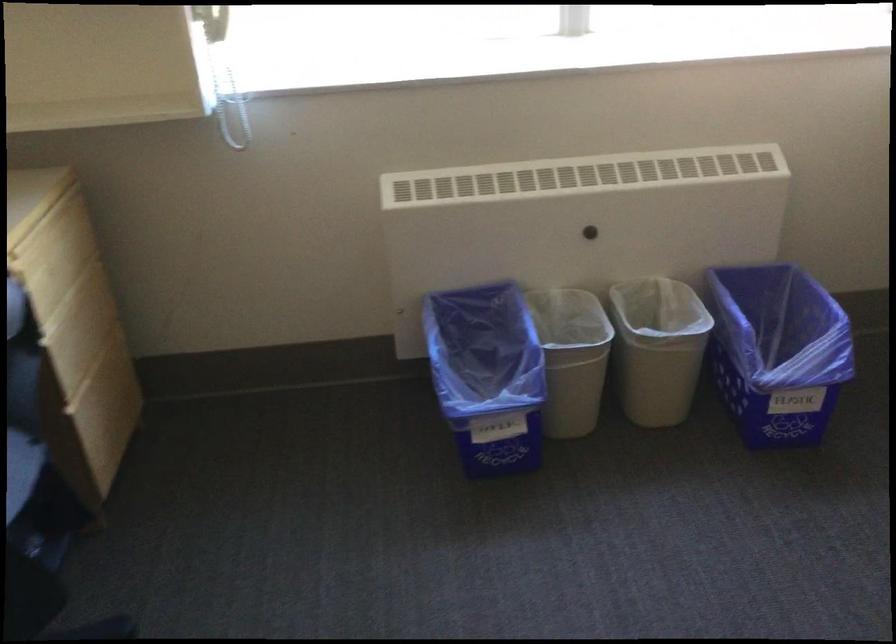
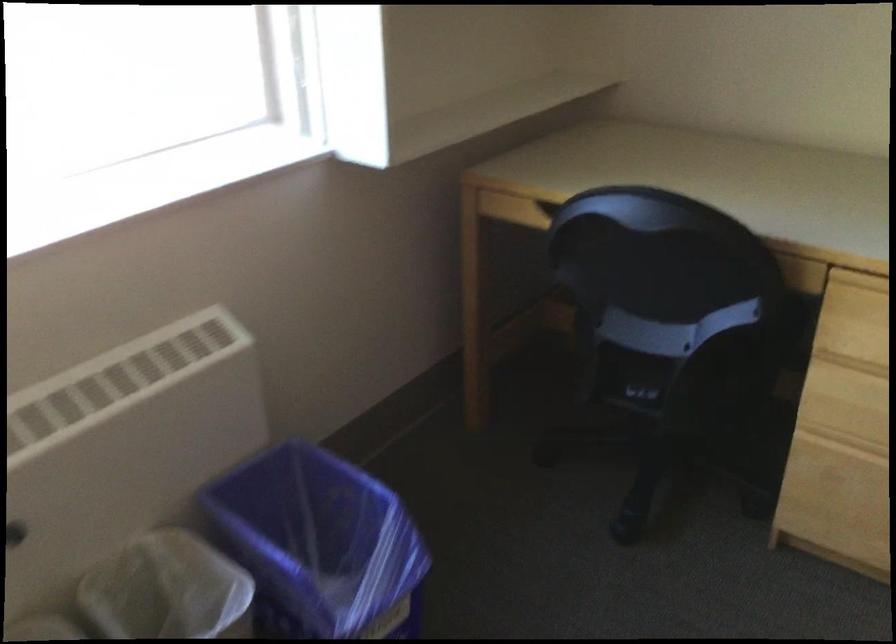
Question: The camera is either moving clockwise (left) or counter-clockwise (right) around the object. The first image is from the beginning of the video and the second image is from the end. Is the camera moving left or right when shooting the video?

Choices:
 (A) Left
 (B) Right

Answer: (A)